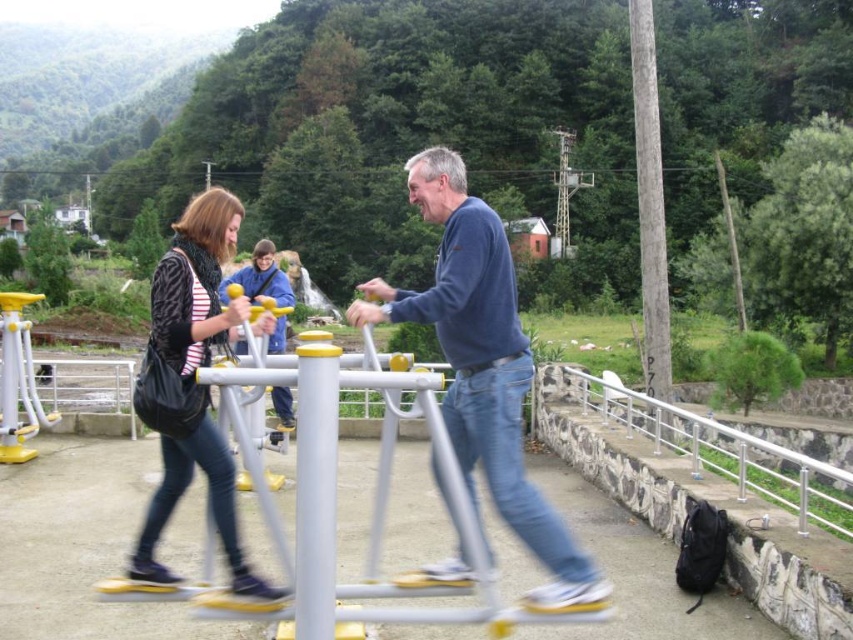
You are a park visitor who wants to use the exercise equipment. You see the blue cotton sweater at center and the satin silver railing at lower right. Which object is located higher in the image?

The blue cotton sweater at center is positioned over the satin silver railing at lower right, meaning it is higher up in the image.

You are a photographer setting up a shot of the blue cotton sweater at center and the satin silver railing at lower right. To ensure both are in focus, you need to know their relative heights. Which object is taller?

The blue cotton sweater at center is taller than the satin silver railing at lower right.

You are a delivery person who needs to place a package in a matte black bag at center. You are currently standing next to a blue cotton sweater at center. Can you reach the bag without moving from your current position if your arm span is 2 meters?

The distance between blue cotton sweater at center and matte black bag at center is 2.44 meters, which is greater than your 2 meter arm span. Therefore, you cannot reach the bag without moving.